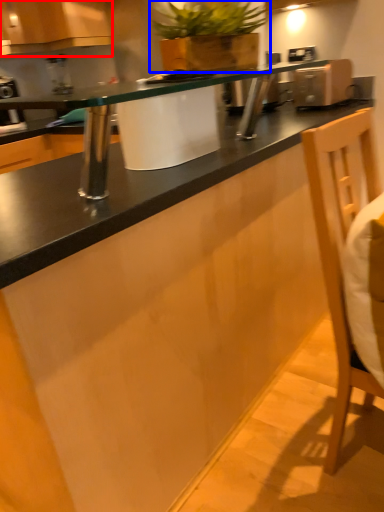
Question: Which object is closer to the camera taking this photo, cabinetry (highlighted by a red box) or houseplant (highlighted by a blue box)?

Choices:
 (A) cabinetry
 (B) houseplant

Answer: (B)